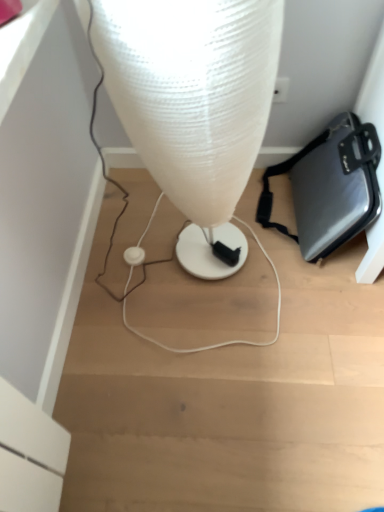
Identify the location of vacant space in front of translucent plastic lamp at center. (210, 350).